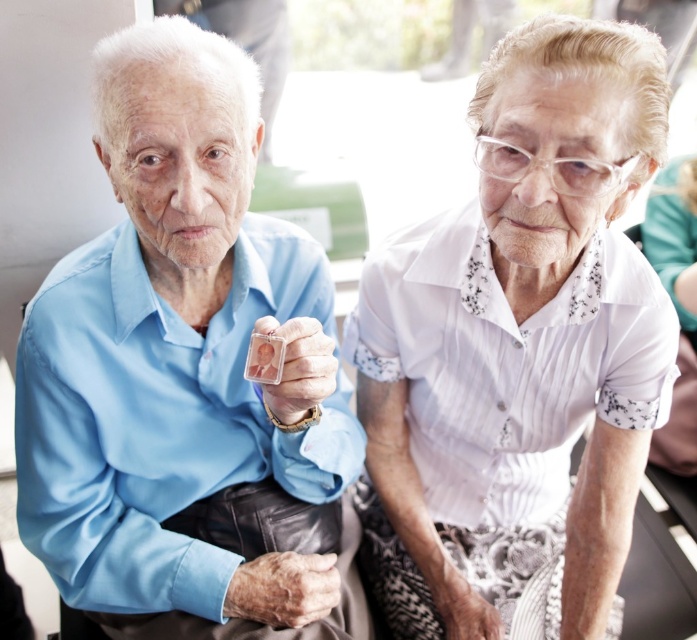
You are a photographer trying to capture a candid shot of the matte blue shirt at center and the white textured blouse at upper right. The camera you have can focus on objects within 12 inches. Will both subjects be in focus if they remain still?

The matte blue shirt at center is 10.96 inches from the white textured blouse at upper right, so yes, both subjects will be in focus as they are within the camera focus range of 12 inches.

You are a photographer trying to capture a candid moment of the two elderly individuals in the scene. You want to ensure that the focus of your shot is precisely on the matte blue shirt at center. Given that your camera can only focus on a single point, would the point at coordinates point (187,376) be the correct location to focus on to capture the matte blue shirt at center?

Yes, the point at coordinates point (187,376) is the correct location to focus on to capture the matte blue shirt at center because the matte blue shirt at center is located at that point.

You are a photographer trying to capture a candid shot of the matte blue shirt at center and the white textured blouse at upper right. Since you want to ensure both are in focus, you need to know which one is shorter. Can you tell me which is shorter?

The matte blue shirt at center is not as tall as white textured blouse at upper right, so the matte blue shirt at center is shorter.